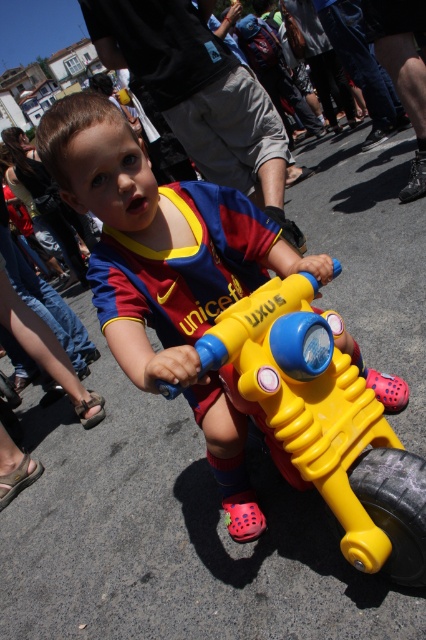
Question: Is yellow plastic toy at center closer to camera compared to yellow plastic toy car at center?

Choices:
 (A) yes
 (B) no

Answer: (B)

Question: Estimate the real-world distances between objects in this image. Which object is closer to the yellow plastic toy at center?

Choices:
 (A) black rubber tire at lower right
 (B) yellow plastic toy car at center

Answer: (B)

Question: Which point is farther to the camera?

Choices:
 (A) yellow plastic toy at center
 (B) black rubber tire at lower right
 (C) yellow plastic toy car at center

Answer: (B)

Question: From the image, what is the correct spatial relationship of yellow plastic toy car at center in relation to black rubber tire at lower right?

Choices:
 (A) below
 (B) above

Answer: (B)

Question: Among these objects, which one is nearest to the camera?

Choices:
 (A) yellow plastic toy car at center
 (B) black rubber tire at lower right
 (C) yellow plastic toy at center

Answer: (A)

Question: Can you confirm if yellow plastic toy at center is positioned to the left of yellow plastic toy car at center?

Choices:
 (A) no
 (B) yes

Answer: (B)